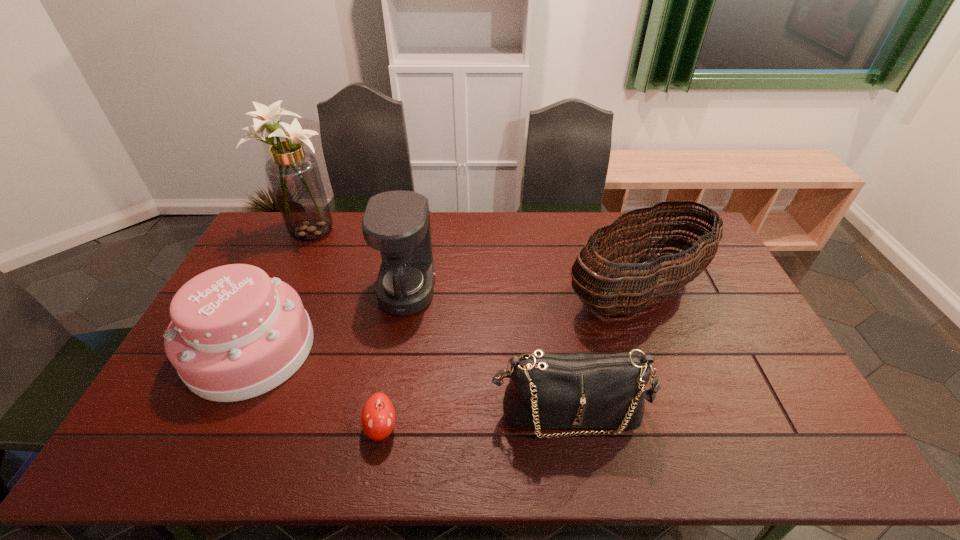
You are a GUI agent. You are given a task and a screenshot of the screen. Output one action in this format:
    pyautogui.click(x=<x>, y=<y>)
    Task: Click on the tallest object
    The height and width of the screenshot is (540, 960).
    Given the screenshot: What is the action you would take?
    pyautogui.click(x=293, y=173)

At what (x,y) coordinates should I click in order to perform the action: click on flower arrangement. Please return your answer as a coordinate pair (x, y). Looking at the image, I should click on (293, 173).

Image resolution: width=960 pixels, height=540 pixels. I want to click on coffee maker, so click(x=397, y=223).

Find the location of `basket`. basket is located at coordinates (627, 292).

Identify the location of handbag. The image size is (960, 540). (577, 390).

Identify the location of birthday cake. The height and width of the screenshot is (540, 960). (x=235, y=333).

Image resolution: width=960 pixels, height=540 pixels. In order to click on the shortest object in this screenshot , I will do `click(378, 415)`.

The image size is (960, 540). I want to click on free location located 0.360m on the front of the tallest object, so click(x=265, y=328).

I want to click on vacant area situated 0.260m on the button side of the coffee maker, so click(515, 291).

At what (x,y) coordinates should I click in order to perform the action: click on vacant space located 0.210m on the left of the basket. Please return your answer as a coordinate pair (x, y). Looking at the image, I should click on (494, 293).